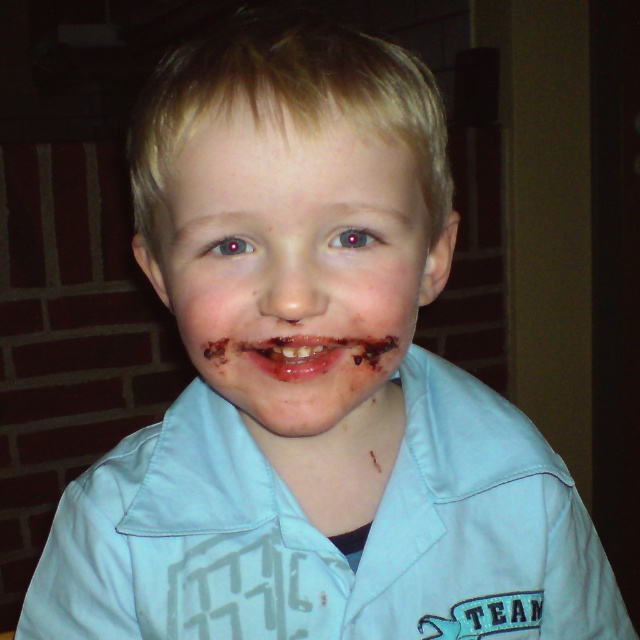
Between chocolate matte face at center and reddish-brown glossy lips at center, which one has less height?

Standing shorter between the two is reddish-brown glossy lips at center.

Does chocolate matte face at center appear over reddish-brown glossy lips at center?

Indeed, chocolate matte face at center is positioned over reddish-brown glossy lips at center.

What do you see at coordinates (296, 268) in the screenshot? I see `chocolate matte face at center` at bounding box center [296, 268].

Locate an element on the screen. The height and width of the screenshot is (640, 640). chocolate matte face at center is located at coordinates (296, 268).